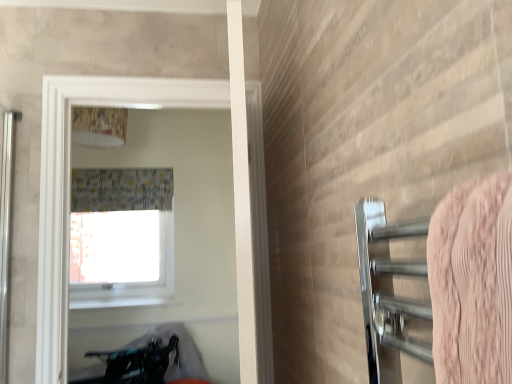
Question: Could you tell me if white glossy lampshade at upper center is turned towards pink textured towel at right?

Choices:
 (A) yes
 (B) no

Answer: (A)

Question: Is white glossy lampshade at upper center bigger than pink textured towel at right?

Choices:
 (A) yes
 (B) no

Answer: (B)

Question: Is white glossy lampshade at upper center far away from pink textured towel at right?

Choices:
 (A) yes
 (B) no

Answer: (A)

Question: From the image's perspective, is white glossy lampshade at upper center beneath pink textured towel at right?

Choices:
 (A) no
 (B) yes

Answer: (A)

Question: Is white glossy lampshade at upper center facing away from pink textured towel at right?

Choices:
 (A) yes
 (B) no

Answer: (B)

Question: Is the position of white glossy lampshade at upper center less distant than that of pink textured towel at right?

Choices:
 (A) no
 (B) yes

Answer: (A)

Question: Does white glossy window at upper center appear on the left side of pink textured towel at right?

Choices:
 (A) no
 (B) yes

Answer: (B)

Question: Does white glossy window at upper center have a larger size compared to pink textured towel at right?

Choices:
 (A) no
 (B) yes

Answer: (B)

Question: Are white glossy window at upper center and pink textured towel at right located far from each other?

Choices:
 (A) no
 (B) yes

Answer: (B)

Question: Would you say white glossy window at upper center is outside pink textured towel at right?

Choices:
 (A) yes
 (B) no

Answer: (A)

Question: Can you confirm if white glossy window at upper center is shorter than pink textured towel at right?

Choices:
 (A) no
 (B) yes

Answer: (A)

Question: Does white glossy window at upper center have a smaller size compared to pink textured towel at right?

Choices:
 (A) no
 (B) yes

Answer: (A)

Question: Is white glossy lampshade at upper center positioned beyond the bounds of transparent glass window at upper center?

Choices:
 (A) no
 (B) yes

Answer: (B)